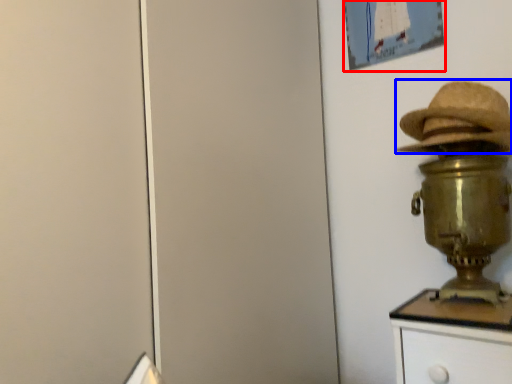
Question: Which of the following is the closest to the observer, picture frame (highlighted by a red box) or hat (highlighted by a blue box)?

Choices:
 (A) picture frame
 (B) hat

Answer: (B)